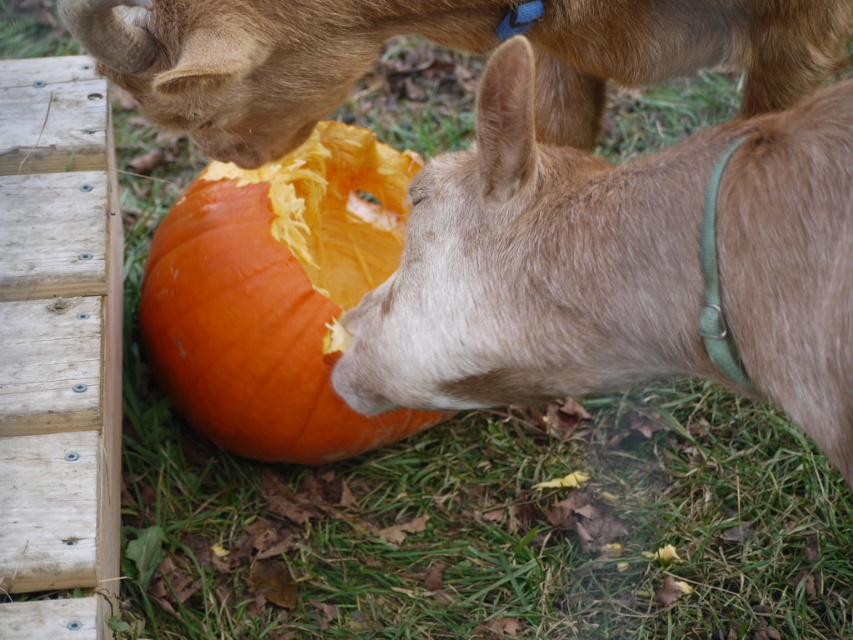
Question: Considering the real-world distances, which object is farthest from the brown fur goat at upper center?

Choices:
 (A) orange matte pumpkin at center
 (B) brown fuzzy goat at lower right

Answer: (A)

Question: Which object is positioned farthest from the brown fuzzy goat at lower right?

Choices:
 (A) brown fur goat at upper center
 (B) orange matte pumpkin at center

Answer: (B)

Question: Which point is farther from the camera taking this photo?

Choices:
 (A) (131, 24)
 (B) (410, 285)

Answer: (A)

Question: Is the position of brown fur goat at upper center less distant than that of orange matte pumpkin at center?

Choices:
 (A) yes
 (B) no

Answer: (A)

Question: Does brown fuzzy goat at lower right come in front of brown fur goat at upper center?

Choices:
 (A) yes
 (B) no

Answer: (A)

Question: Can you confirm if brown fuzzy goat at lower right is smaller than brown fur goat at upper center?

Choices:
 (A) no
 (B) yes

Answer: (A)